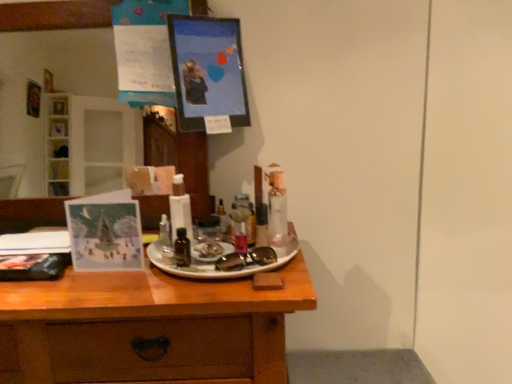
Locate an element on the screen. Image resolution: width=512 pixels, height=384 pixels. free point to the left of metallic silver spray can at center, which is the third toiletry from left to right is located at coordinates (199, 251).